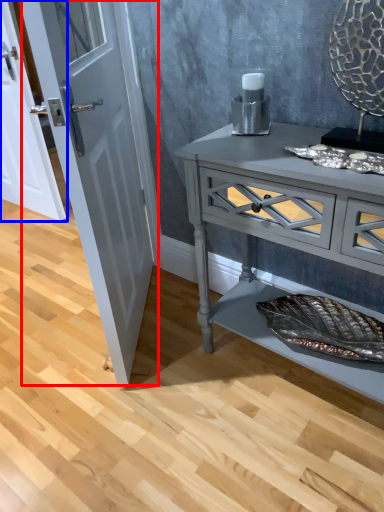
Question: Which object is further to the camera taking this photo, door (highlighted by a red box) or door (highlighted by a blue box)?

Choices:
 (A) door
 (B) door

Answer: (B)